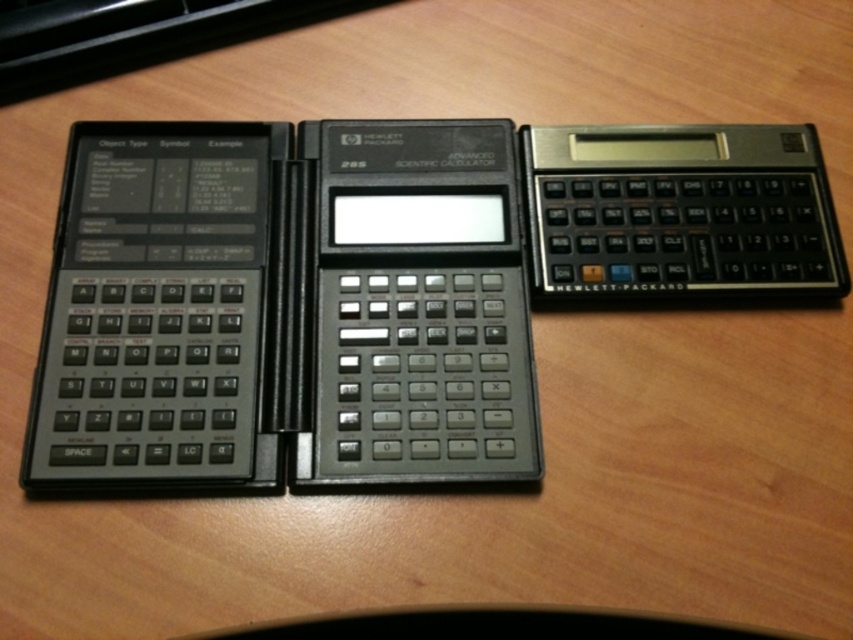
Which is above, black matte scientific calculator at left or black plastic keyboard at left?

black plastic keyboard at left is above.

You are a GUI agent. You are given a task and a screenshot of the screen. Output one action in this format:
    pyautogui.click(x=<x>, y=<y>)
    Task: Click on the black matte scientific calculator at left
    This screenshot has height=640, width=853.
    Given the screenshot: What is the action you would take?
    pyautogui.click(x=286, y=308)

Does black matte scientific calculator at left have a greater width compared to black plastic keyboard at lower center?

Incorrect, black matte scientific calculator at left's width does not surpass black plastic keyboard at lower center's.

From the picture: Does black matte scientific calculator at left have a lesser height compared to black plastic keyboard at lower center?

In fact, black matte scientific calculator at left may be taller than black plastic keyboard at lower center.

Is point (466, 236) positioned in front of point (190, 636)?

No.

The width and height of the screenshot is (853, 640). In order to click on black matte scientific calculator at left in this screenshot , I will do `click(286, 308)`.

Who is positioned more to the left, black plastic keyboard at left or black plastic keyboard at lower center?

From the viewer's perspective, black plastic keyboard at left appears more on the left side.

Locate an element on the screen. The width and height of the screenshot is (853, 640). black plastic keyboard at left is located at coordinates (132, 35).

The width and height of the screenshot is (853, 640). Describe the element at coordinates (132, 35) in the screenshot. I see `black plastic keyboard at left` at that location.

Where is `black plastic keyboard at left`? The width and height of the screenshot is (853, 640). black plastic keyboard at left is located at coordinates (132, 35).